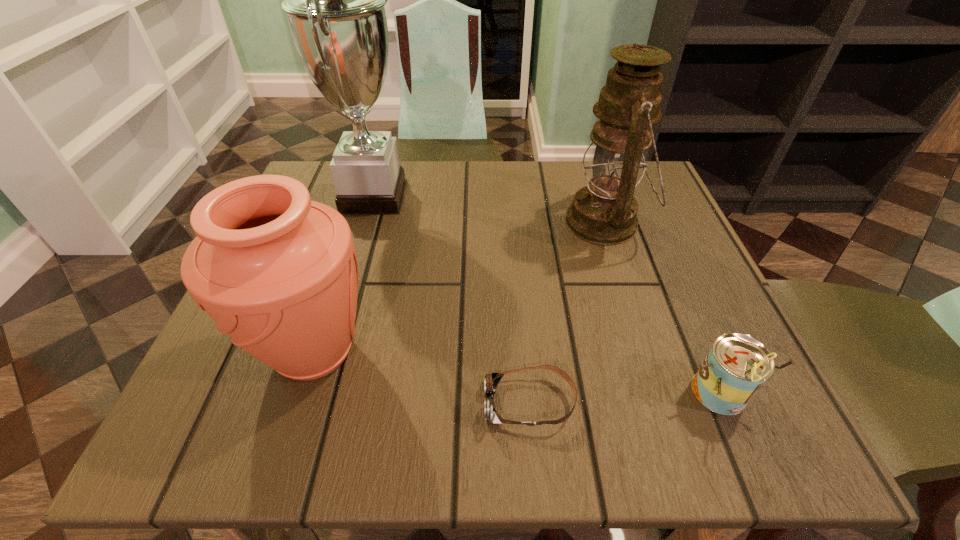
Locate an element on the screen. The width and height of the screenshot is (960, 540). free space that is in between the tallest object and the second shortest object is located at coordinates (546, 295).

The width and height of the screenshot is (960, 540). Find the location of `free space between the goggles and the can`. free space between the goggles and the can is located at coordinates (624, 398).

The width and height of the screenshot is (960, 540). I want to click on blank region between the fourth tallest object and the trophy cup, so click(546, 295).

The image size is (960, 540). Find the location of `vacant space that's between the fourth shortest object and the can`. vacant space that's between the fourth shortest object and the can is located at coordinates (661, 308).

Locate an element on the screen. The width and height of the screenshot is (960, 540). free space between the tallest object and the goggles is located at coordinates (451, 300).

What are the coordinates of `vacant space that is in between the vase and the second tallest object` in the screenshot? It's located at point(460,287).

This screenshot has width=960, height=540. In order to click on vacant area that lies between the goggles and the oil lamp in this screenshot , I will do 567,313.

Where is `vacant area that lies between the goggles and the oil lamp`? vacant area that lies between the goggles and the oil lamp is located at coordinates (567, 313).

This screenshot has height=540, width=960. I want to click on empty space between the oil lamp and the can, so click(x=661, y=308).

I want to click on object that is the closest to the tallest object, so click(x=278, y=273).